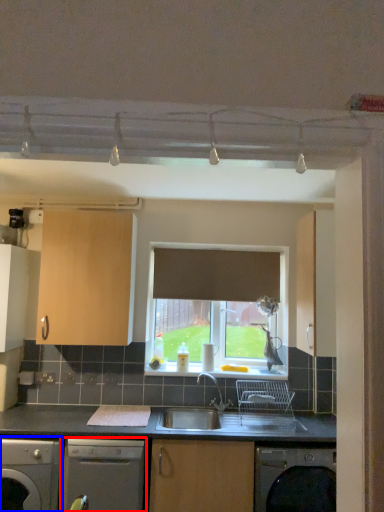
Question: Which object is further to the camera taking this photo, dishwasher (highlighted by a red box) or dishwasher (highlighted by a blue box)?

Choices:
 (A) dishwasher
 (B) dishwasher

Answer: (A)